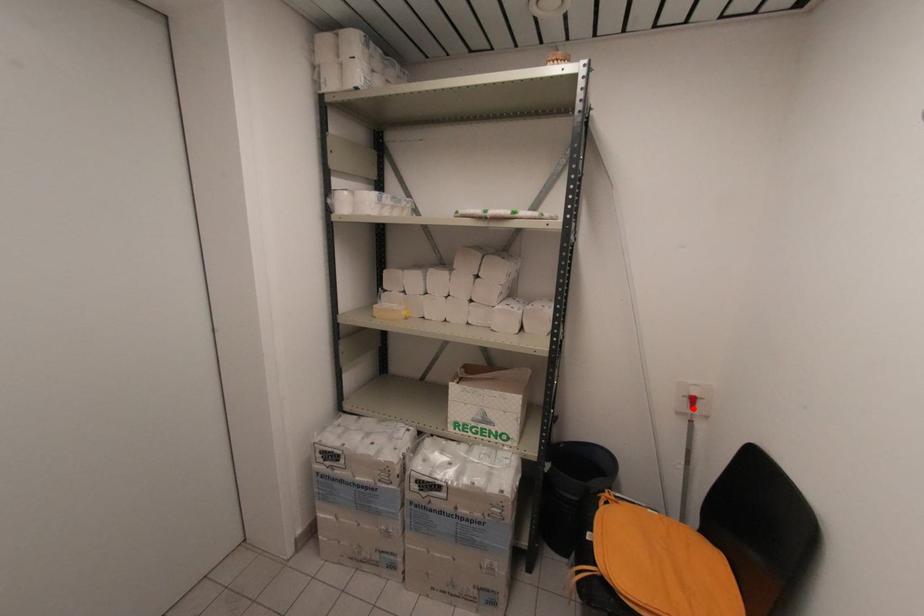
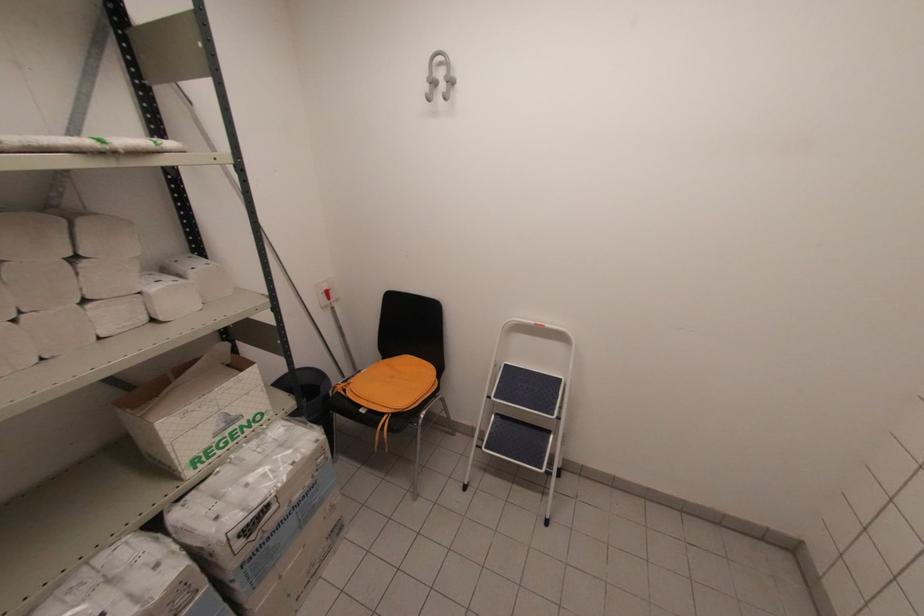
Find the pixel in the second image that matches the highlighted location in the first image.

(330, 299)